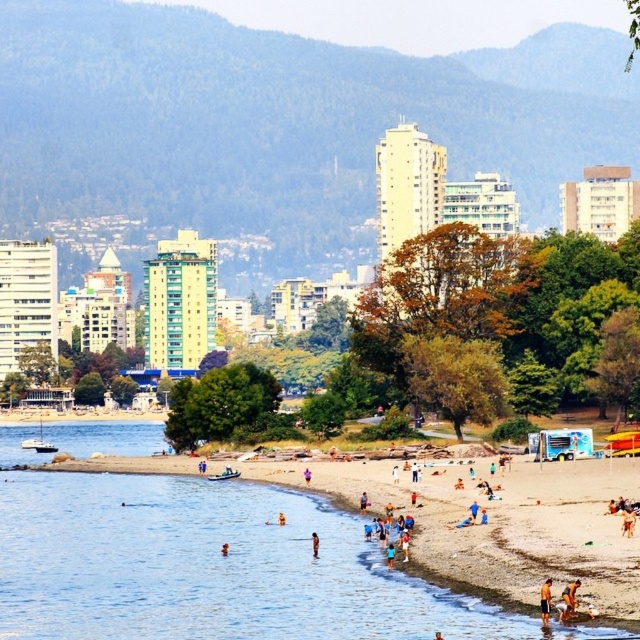
You are a photographer trying to capture a wide shot of the smooth sand beach at lower right and the tan skin person at lower right. Given that your camera has a fixed focal length, which object should you focus on to ensure both are in frame without moving the camera?

You should focus on the smooth sand beach at lower right because its width is larger than the tan skin person at lower right, ensuring both will fit in the frame.

In the scene shown: You are a photographer trying to capture a wide shot of the beach scene. You want to include both the smooth sand beach at lower right and the tan skin person at beach center in your frame. Which object should you focus on to ensure both are visible without zooming in or out?

The smooth sand beach at lower right is larger in size than the tan skin person at beach center, so focusing on the smooth sand beach at lower right will allow both objects to be visible in the frame without needing to adjust the zoom.